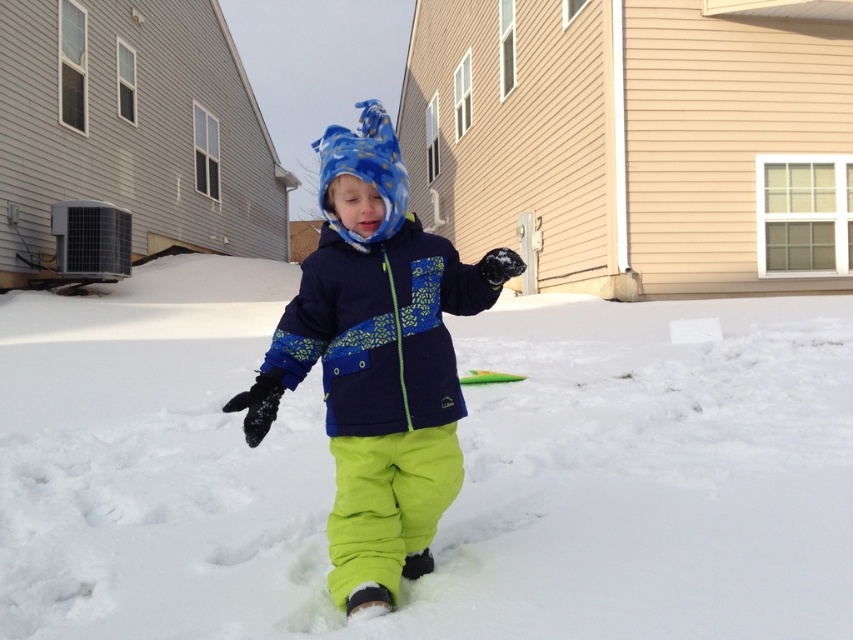
The child is wearing a navy blue fleece jacket at center and standing on white fluffy snow at center. Which one has a greater width?

The white fluffy snow at center has a greater width than the navy blue fleece jacket at center.

You are a parent trying to take a photo of your child wearing the matte blue snowsuit at center while they stand on the white fluffy snow at center. To ensure the snowsuit is visible, should you adjust the camera settings to prioritize the blue color or the white snow?

The white fluffy snow at center might be wider than matte blue snowsuit at center, so adjusting the camera settings to prioritize the blue color of the matte blue snowsuit at center would help ensure it stands out against the potentially broader white background.